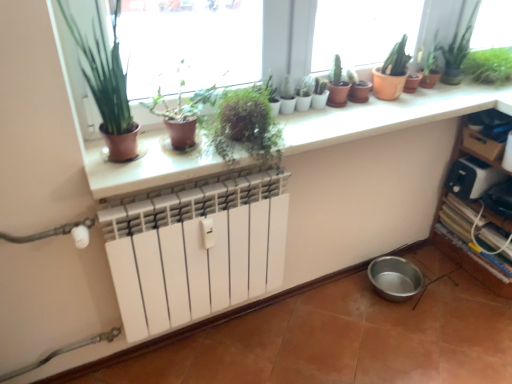
Locate an element on the screen. The image size is (512, 384). free location in front of green matte cactus at center, the third houseplant viewed from the right is located at coordinates (324, 115).